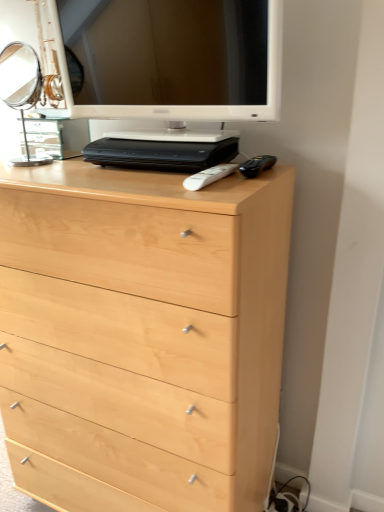
You are a GUI agent. You are given a task and a screenshot of the screen. Output one action in this format:
    pyautogui.click(x=<x>, y=<y>)
    Task: Click on the vacant region to the right of white plastic remote at center
    This screenshot has width=384, height=512.
    Given the screenshot: What is the action you would take?
    point(255,176)